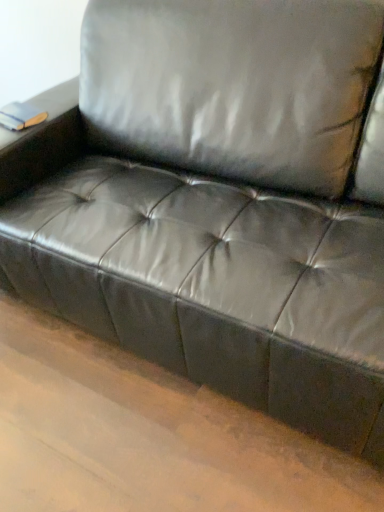
The height and width of the screenshot is (512, 384). Describe the element at coordinates (21, 116) in the screenshot. I see `blue matte book at upper left` at that location.

Locate an element on the screen. blue matte book at upper left is located at coordinates (21, 116).

This screenshot has height=512, width=384. What are the coordinates of `blue matte book at upper left` in the screenshot? It's located at (21, 116).